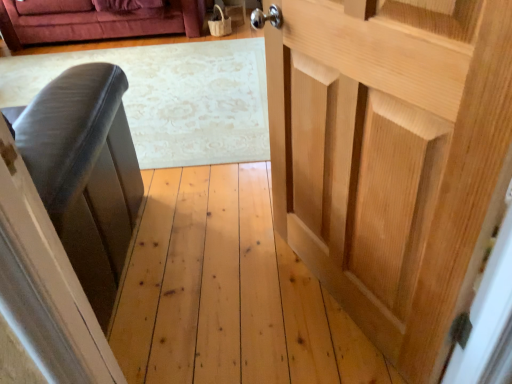
Question: Do you think velvet grey armchair at left is within natural wood door at right, or outside of it?

Choices:
 (A) outside
 (B) inside

Answer: (A)

Question: Is velvet grey armchair at left taller or shorter than natural wood door at right?

Choices:
 (A) short
 (B) tall

Answer: (B)

Question: From the image's perspective, relative to natural wood door at right, is velvet grey armchair at left above or below?

Choices:
 (A) above
 (B) below

Answer: (A)

Question: Considering the positions of natural wood door at right and velvet grey armchair at left in the image, is natural wood door at right taller or shorter than velvet grey armchair at left?

Choices:
 (A) tall
 (B) short

Answer: (B)

Question: Is point (438, 354) closer or farther from the camera than point (98, 82)?

Choices:
 (A) closer
 (B) farther

Answer: (A)

Question: Would you say natural wood door at right is to the left or to the right of velvet grey armchair at left in the picture?

Choices:
 (A) right
 (B) left

Answer: (A)

Question: Is natural wood door at right wider or thinner than velvet grey armchair at left?

Choices:
 (A) thin
 (B) wide

Answer: (A)